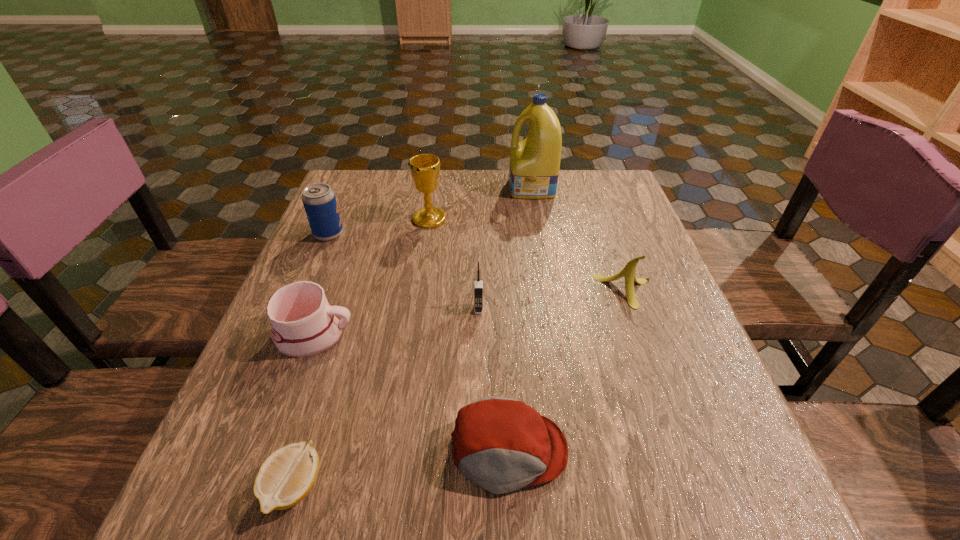
Locate an element on the screen. This screenshot has width=960, height=540. chalice at the far edge is located at coordinates (425, 168).

In order to click on cap positioned at the near edge in this screenshot , I will do `click(501, 444)`.

Locate an element on the screen. lemon present at the near edge is located at coordinates (286, 477).

You are a GUI agent. You are given a task and a screenshot of the screen. Output one action in this format:
    pyautogui.click(x=<x>, y=<y>)
    Task: Click on the beer can present at the left edge
    
    Given the screenshot: What is the action you would take?
    pyautogui.click(x=319, y=200)

At what (x,y) coordinates should I click in order to perform the action: click on mug positioned at the left edge. Please return your answer as a coordinate pair (x, y). This screenshot has height=540, width=960. Looking at the image, I should click on (303, 323).

This screenshot has width=960, height=540. I want to click on lemon that is positioned at the left edge, so click(x=286, y=477).

Find the location of `object positioned at the right edge`. object positioned at the right edge is located at coordinates (628, 272).

Find the location of a particular element. object that is at the near left corner is located at coordinates (286, 477).

The width and height of the screenshot is (960, 540). In the image, there is a desktop. In order to click on vacant region at the far edge in this screenshot , I will do `click(490, 193)`.

In the image, there is a desktop. Where is `vacant space at the near edge`? vacant space at the near edge is located at coordinates (461, 482).